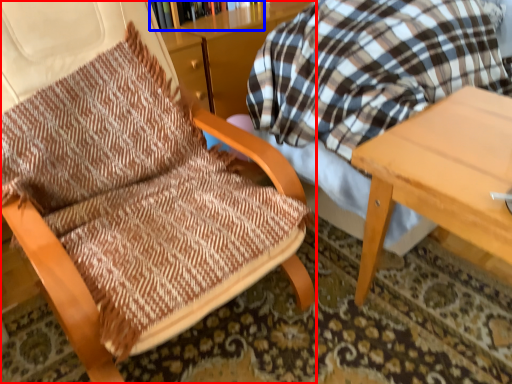
Question: Which point is closer to the camera, chair (highlighted by a red box) or bookcase (highlighted by a blue box)?

Choices:
 (A) chair
 (B) bookcase

Answer: (A)